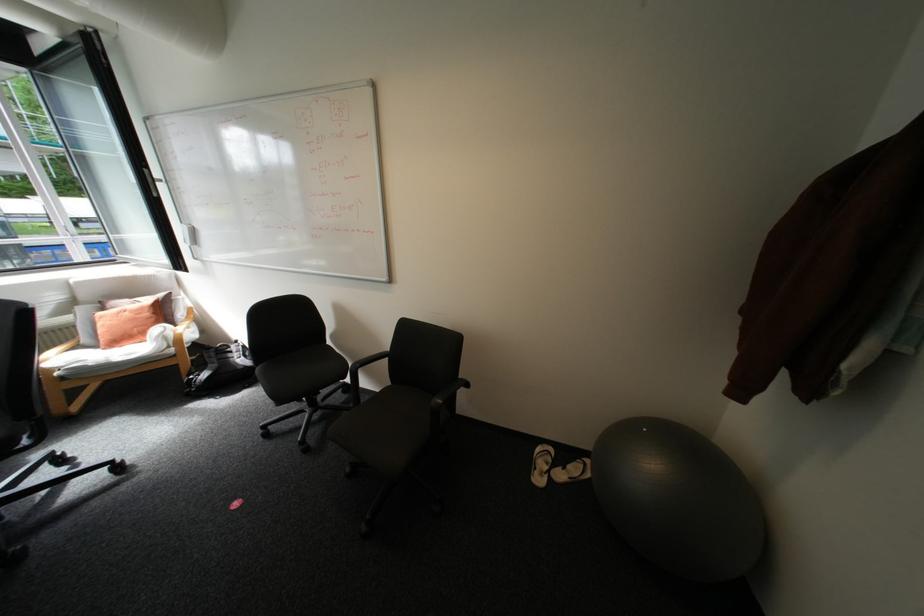
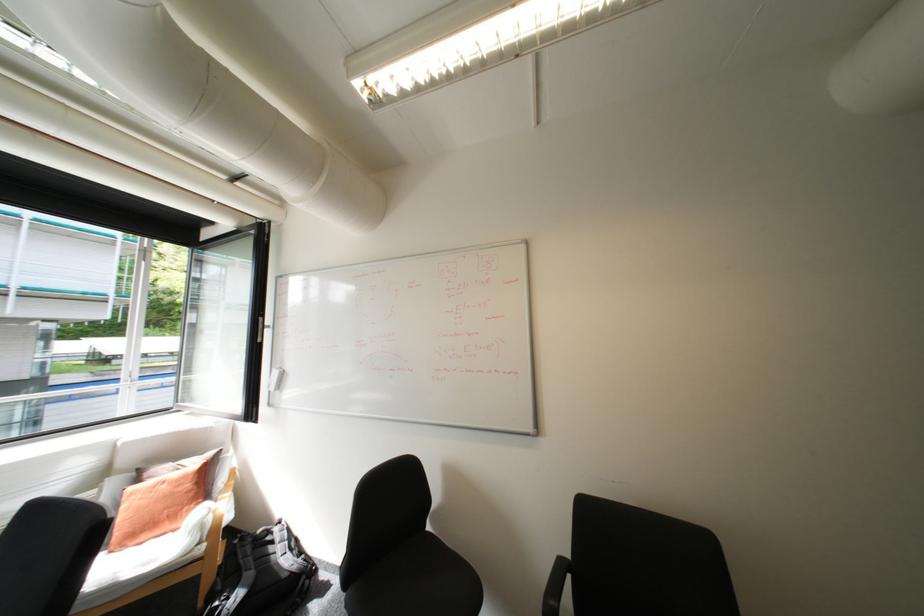
Where in the second image is the point corresponding to (209,375) from the first image?

(238, 599)